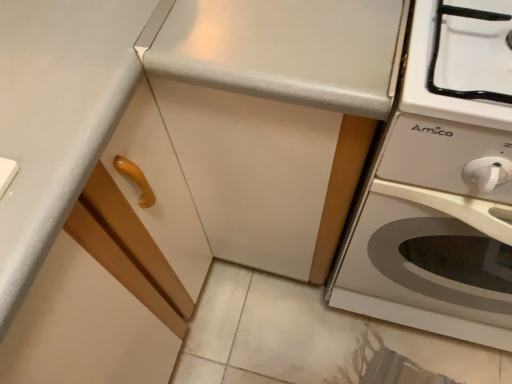
This screenshot has width=512, height=384. Describe the element at coordinates (252, 172) in the screenshot. I see `satin white cabinet at center` at that location.

Measure the distance between point (x=209, y=190) and camera.

The depth of point (x=209, y=190) is 78.00 centimeters.

Identify the location of satin white cabinet at center. (252, 172).

Identify the location of satin white cabinet at center. (252, 172).